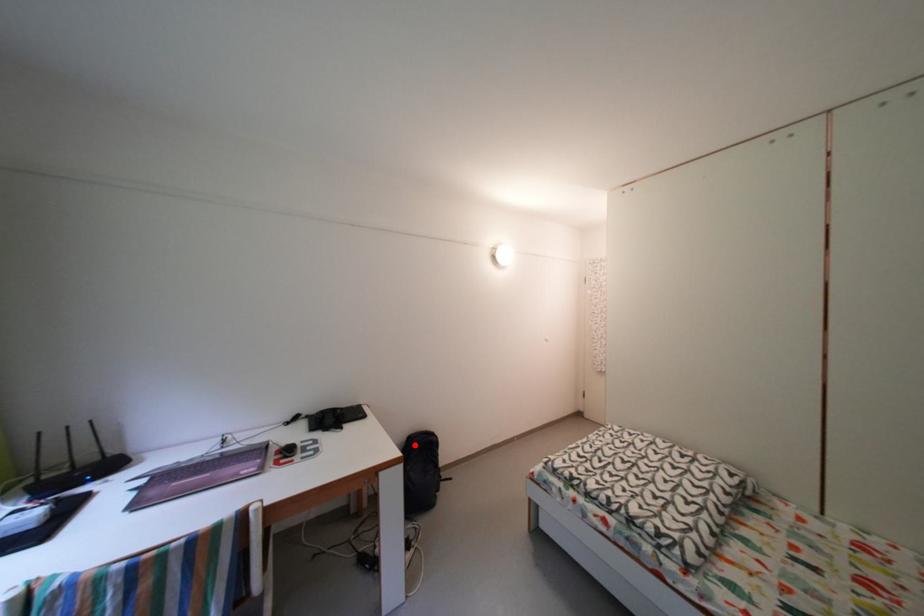
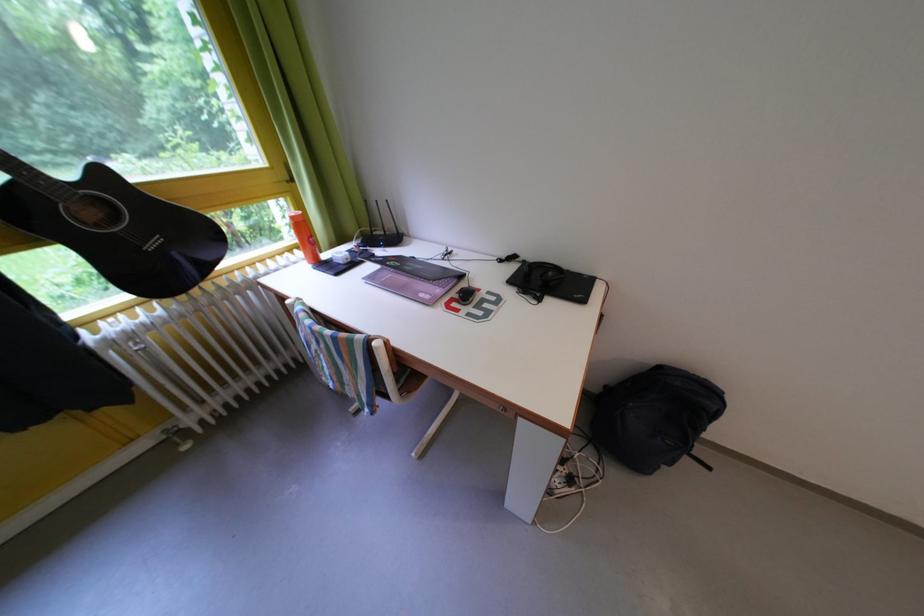
Question: I am providing you with two images of the same scene from different viewpoints. Image1 has a red point marked. In image2, the corresponding 3D location appears at what relative position? Reply with the corresponding letter.

Choices:
 (A) Closer
 (B) Farther

Answer: (A)